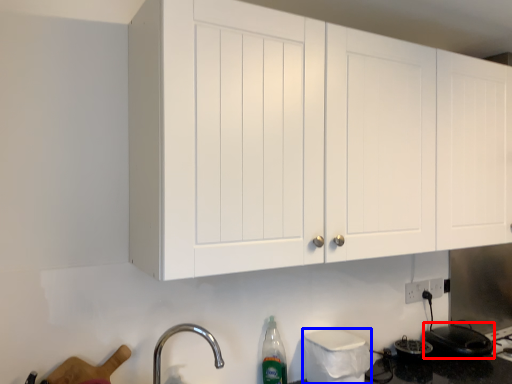
Question: Which of the following is the closest to the observer, appliance (highlighted by a red box) or appliance (highlighted by a blue box)?

Choices:
 (A) appliance
 (B) appliance

Answer: (B)